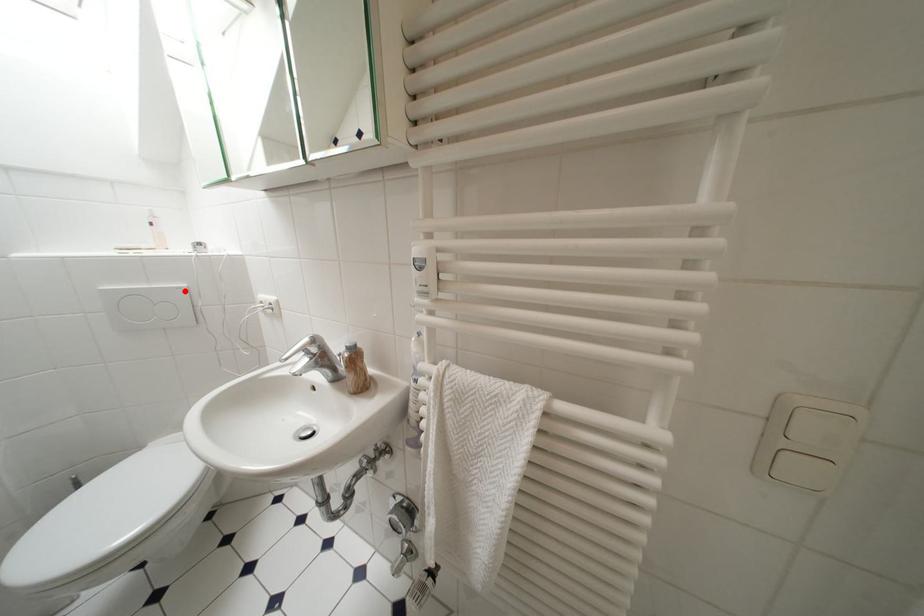
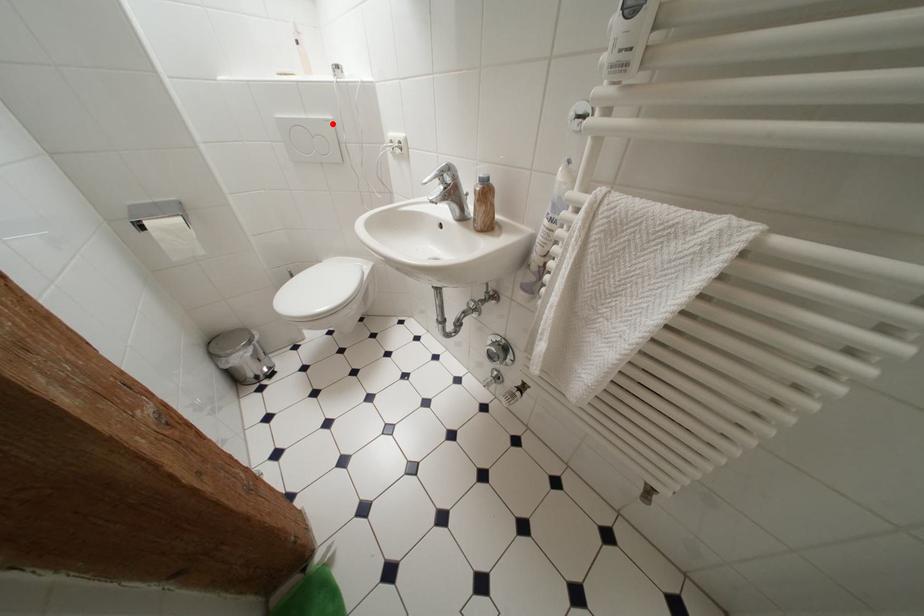
I am providing you with two images of the same scene from different viewpoints. A red point is marked on the first image and another point is marked on the second image. Is the marked point in image1 the same physical position as the marked point in image2?

Yes